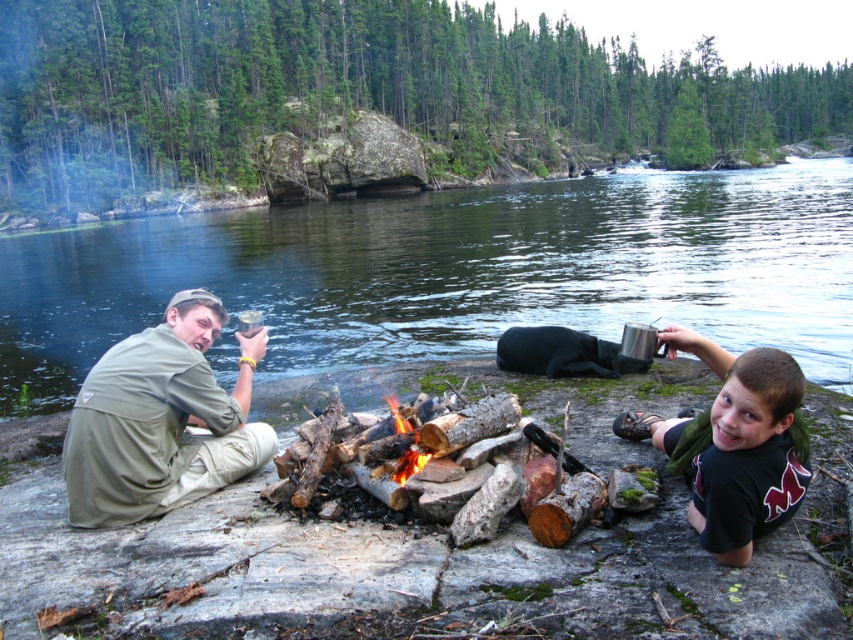
Question: Estimate the real-world distances between objects in this image. Which object is farther from the black matte shirt at lower right?

Choices:
 (A) green fabric shirt at left
 (B) clear water at river center

Answer: (B)

Question: Observing the image, what is the correct spatial positioning of clear water at river center in reference to black matte shirt at lower right?

Choices:
 (A) below
 (B) above

Answer: (B)

Question: Observing the image, what is the correct spatial positioning of clear water at river center in reference to black matte shirt at lower right?

Choices:
 (A) below
 (B) above

Answer: (B)

Question: Which point is farther from the camera taking this photo?

Choices:
 (A) (196, 352)
 (B) (16, 348)

Answer: (B)

Question: Which object is the closest to the clear water at river center?

Choices:
 (A) black matte shirt at lower right
 (B) green fabric shirt at left

Answer: (B)

Question: Can you confirm if clear water at river center is positioned below green fabric shirt at left?

Choices:
 (A) yes
 (B) no

Answer: (B)